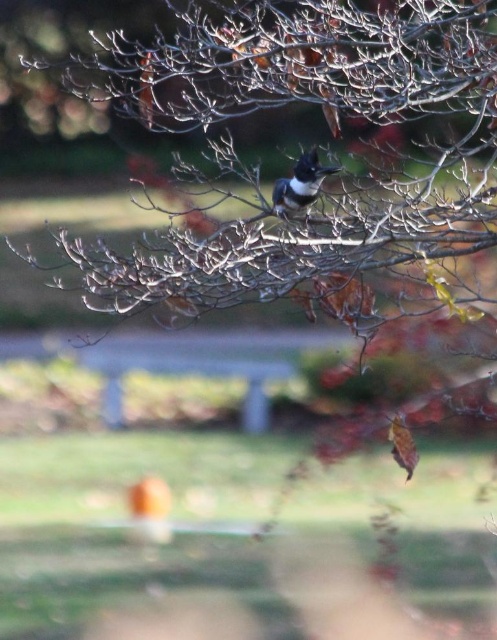
Question: Considering the real-world distances, which object is closest to the shiny black bird at center?

Choices:
 (A) wooden park bench at center
 (B) brown matte branch at upper center

Answer: (B)

Question: Is wooden park bench at center to the left of shiny black bird at center from the viewer's perspective?

Choices:
 (A) no
 (B) yes

Answer: (B)

Question: Among these objects, which one is nearest to the camera?

Choices:
 (A) shiny black bird at center
 (B) brown matte branch at upper center
 (C) wooden park bench at center

Answer: (B)

Question: Where is brown matte branch at upper center located in relation to shiny black bird at center in the image?

Choices:
 (A) above
 (B) below

Answer: (A)

Question: Can you confirm if wooden park bench at center is positioned to the left of shiny black bird at center?

Choices:
 (A) yes
 (B) no

Answer: (A)

Question: Which object appears farthest from the camera in this image?

Choices:
 (A) brown matte branch at upper center
 (B) shiny black bird at center

Answer: (B)